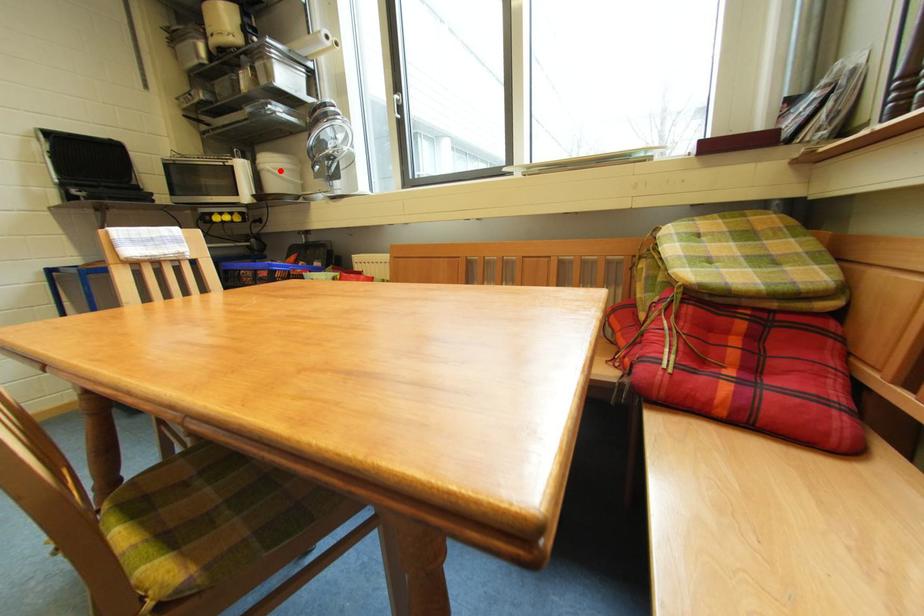
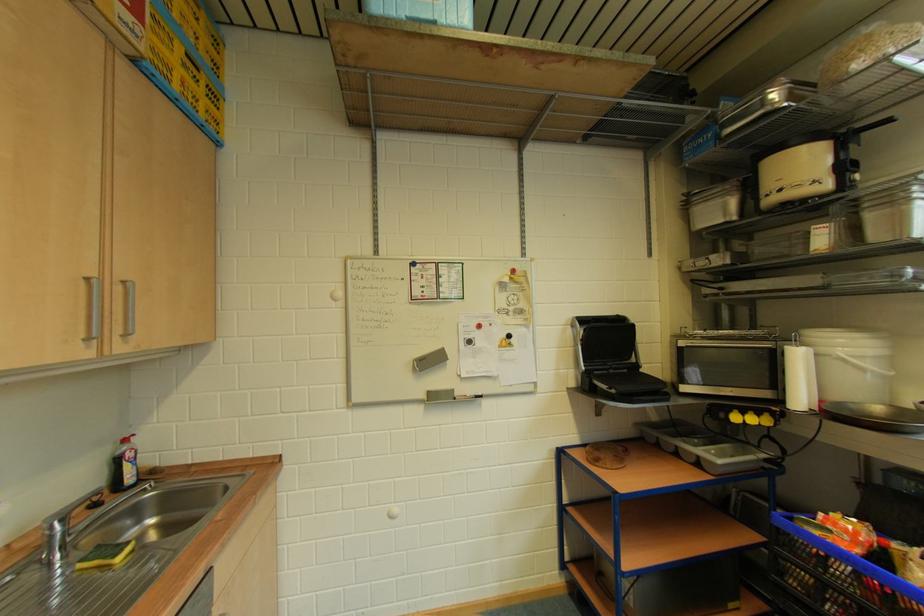
In the second image, find the point that corresponds to the highlighted location in the first image.

(858, 360)